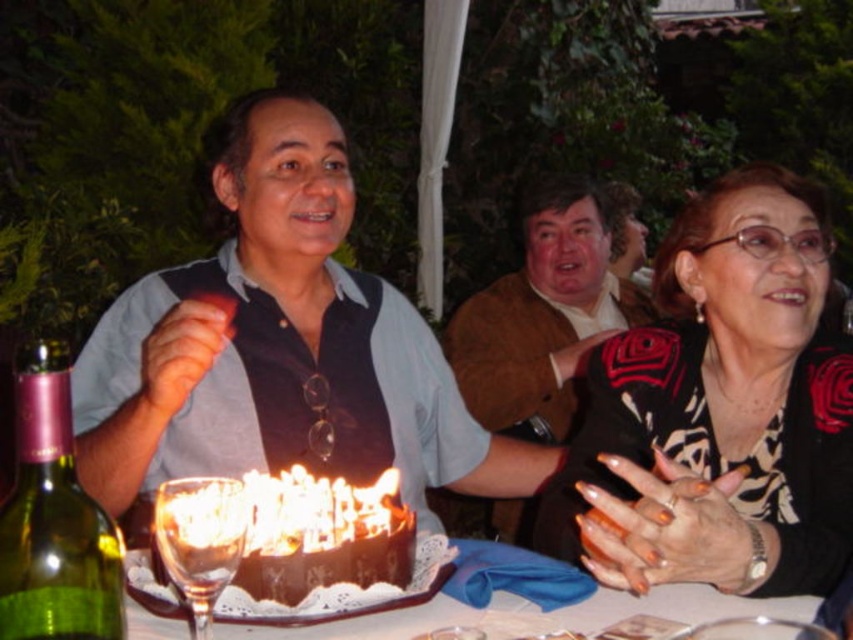
Between point (212, 486) and point (24, 348), which one is positioned in front?

Positioned in front is point (24, 348).

Is chocolate cake at center closer to the viewer compared to green glass bottle at lower left?

No, chocolate cake at center is further to the viewer.

Is point (218, 525) farther from viewer compared to point (61, 470)?

Yes, it is.

Where is `chocolate cake at center`? chocolate cake at center is located at coordinates (289, 531).

Measure the distance between chocolate cake at center and transparent glass at center.

They are 11.19 centimeters apart.

Which is in front, point (326, 493) or point (194, 557)?

Point (194, 557) is more forward.

You are a GUI agent. You are given a task and a screenshot of the screen. Output one action in this format:
    pyautogui.click(x=<x>, y=<y>)
    Task: Click on the chocolate cake at center
    The width and height of the screenshot is (853, 640).
    Given the screenshot: What is the action you would take?
    pyautogui.click(x=289, y=531)

Find the location of `chocolate cake at center`. chocolate cake at center is located at coordinates (289, 531).

Can you confirm if matte brown vest at center is taller than brown fuzzy sweater at upper center?

Incorrect, matte brown vest at center's height is not larger of brown fuzzy sweater at upper center's.

What are the coordinates of `matte brown vest at center` in the screenshot? It's located at (279, 344).

Is point (276, 129) positioned before point (531, 394)?

Yes, it is in front of point (531, 394).

Identify the location of matte brown vest at center. Image resolution: width=853 pixels, height=640 pixels. (279, 344).